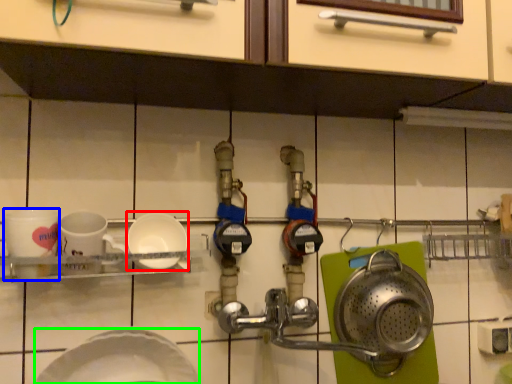
Question: Based on their relative distances, which object is nearer to plate (highlighted by a red box)? Choose from coffee cup (highlighted by a blue box) and plate (highlighted by a green box).

Choices:
 (A) coffee cup
 (B) plate

Answer: (A)